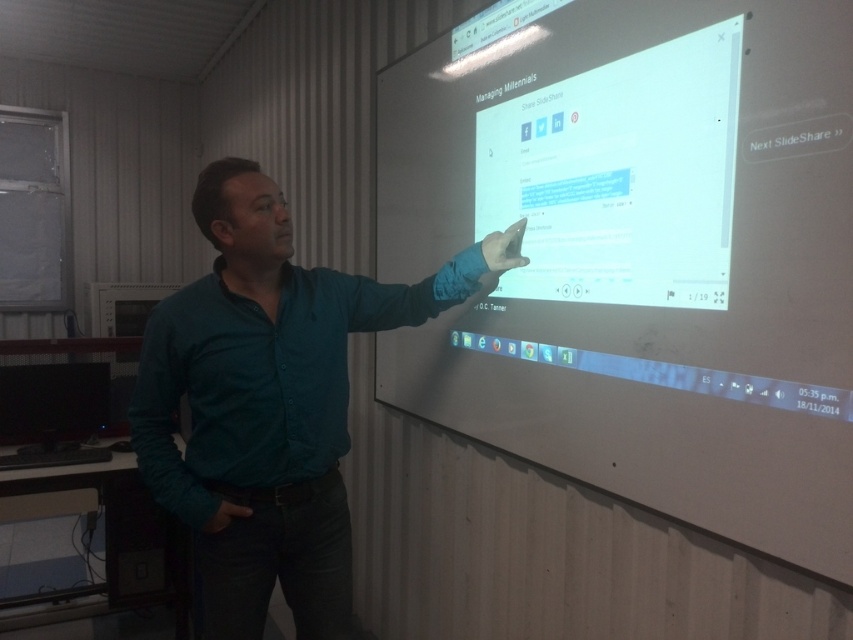
Question: Does white matte projection screen at center appear under teal shirt at center?

Choices:
 (A) no
 (B) yes

Answer: (A)

Question: Does white matte projection screen at center appear under teal shirt at center?

Choices:
 (A) yes
 (B) no

Answer: (B)

Question: Is white matte projection screen at center further to camera compared to teal shirt at center?

Choices:
 (A) yes
 (B) no

Answer: (B)

Question: Which object appears closest to the camera in this image?

Choices:
 (A) teal shirt at center
 (B) white matte projection screen at center

Answer: (B)